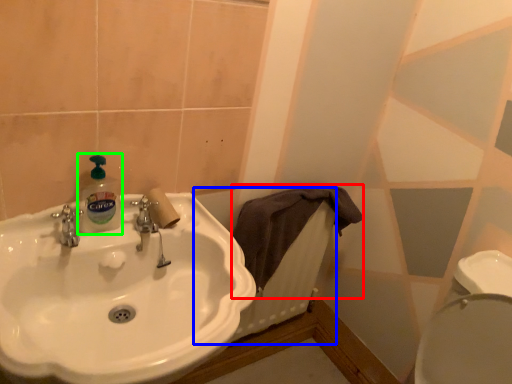
Question: Considering the real-world distances, which object is farthest from bath towel (highlighted by a red box)? radiator (highlighted by a blue box) or cleaning product (highlighted by a green box)?

Choices:
 (A) radiator
 (B) cleaning product

Answer: (B)